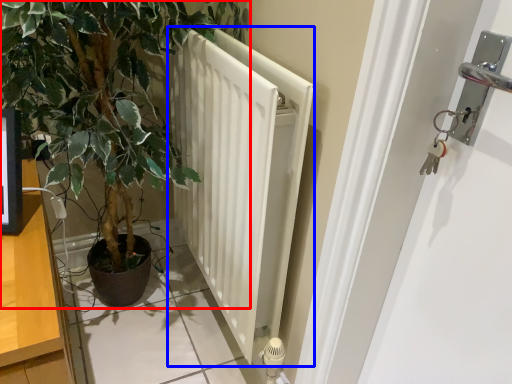
Question: Which object appears closest to the camera in this image, houseplant (highlighted by a red box) or radiator (highlighted by a blue box)?

Choices:
 (A) houseplant
 (B) radiator

Answer: (A)